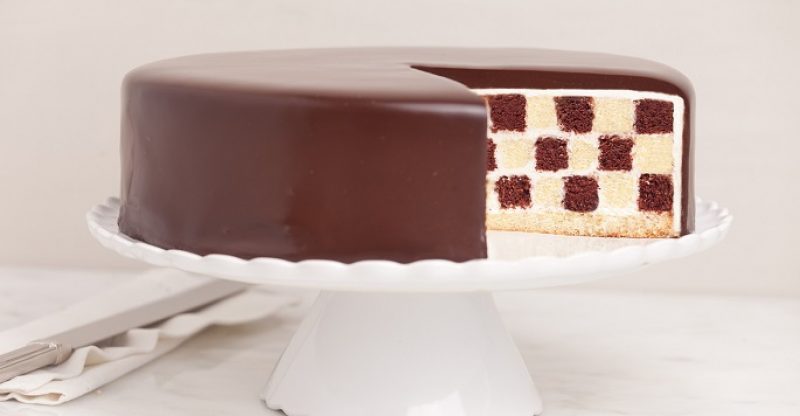
The width and height of the screenshot is (800, 416). What are the coordinates of `top surface of cake plate` in the screenshot? It's located at (520, 243).